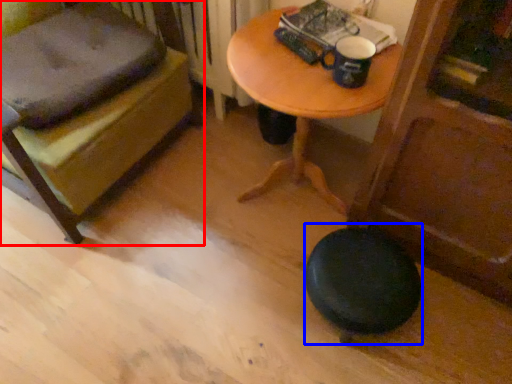
Question: Among these objects, which one is nearest to the camera, furniture (highlighted by a red box) or stool (highlighted by a blue box)?

Choices:
 (A) furniture
 (B) stool

Answer: (A)